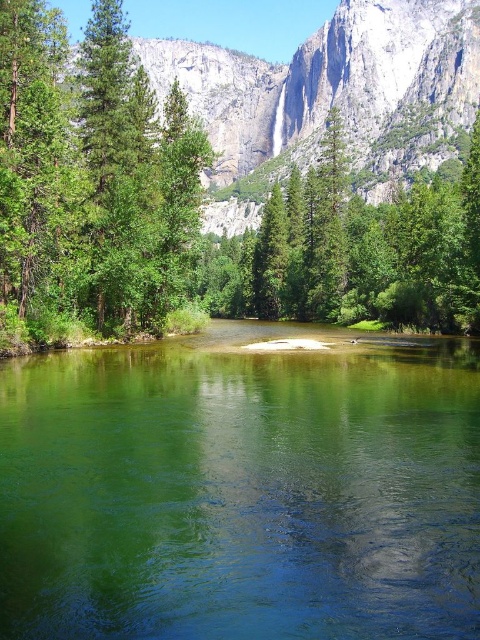
You are standing at the origin point of the image coordinate system. You want to walk towards the green leafy tree at center. Which direction should you move in terms of x and y coordinates?

To reach the green leafy tree at center located at coordinates x 0.270 and y 0.498, you should move in the positive x and positive y direction from the origin point.

In the scene shown: You are an environmental scientist studying the growth patterns of trees in this valley. You observe the green matte tree at left and the green matte tree at center. Which tree would you expect to have a younger age based on their height?

The green matte tree at left is shorter than the green matte tree at center, so it is likely younger since younger trees are typically shorter.

You are standing on the riverbank and want to cross to the other side. The clear glass lake at center and the green matte tree at left are in your path. Which one is wider, making it harder to walk around?

The clear glass lake at center might be wider than green matte tree at left, so it would be harder to walk around the clear glass lake at center.